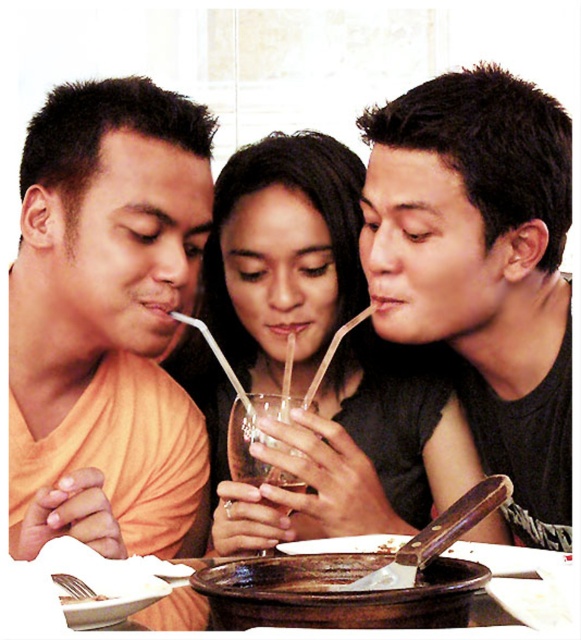
Question: Does orange matte shirt at left come in front of transparent glass at center?

Choices:
 (A) no
 (B) yes

Answer: (A)

Question: Which point appears farthest from the camera in this image?

Choices:
 (A) (451, 97)
 (B) (303, 401)
 (C) (144, 93)

Answer: (B)

Question: Considering the relative positions of transparent glass cup at center and transparent glass at center in the image provided, where is transparent glass cup at center located with respect to transparent glass at center?

Choices:
 (A) above
 (B) below

Answer: (A)

Question: Is orange matte shirt at left positioned behind transparent glass at center?

Choices:
 (A) no
 (B) yes

Answer: (B)

Question: Among these points, which one is nearest to the camera?

Choices:
 (A) (117, 97)
 (B) (113, 560)
 (C) (382, 154)
 (D) (300, 403)

Answer: (B)

Question: Considering the real-world distances, which object is farthest from the white paper napkin at lower left?

Choices:
 (A) transparent glass cup at center
 (B) orange matte shirt at left
 (C) transparent glass at center

Answer: (A)